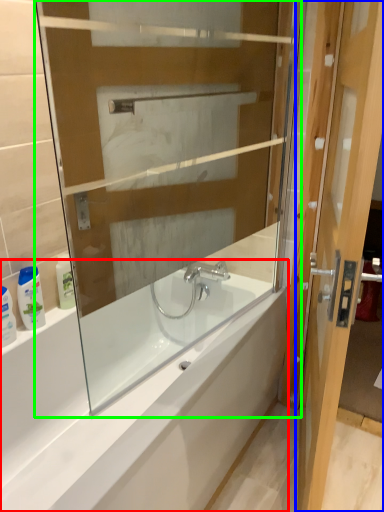
Question: Estimate the real-world distances between objects in this image. Which object is farther from bathtub (highlighted by a red box), door (highlighted by a blue box) or glass box (highlighted by a green box)?

Choices:
 (A) door
 (B) glass box

Answer: (A)